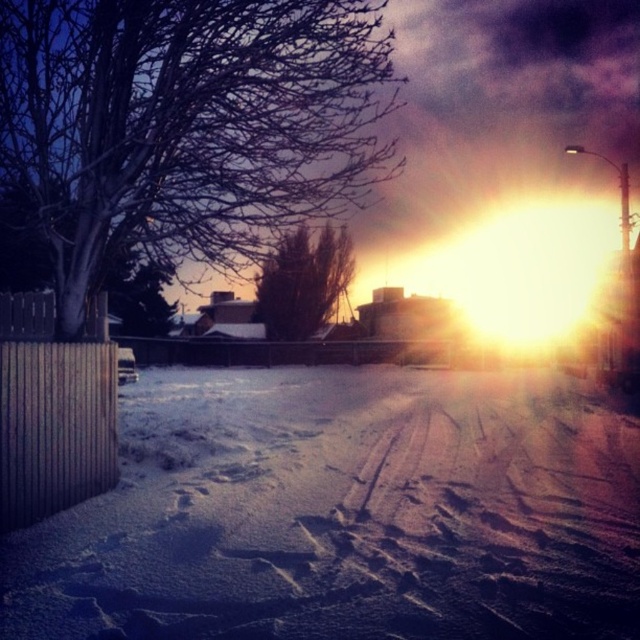
Is point (225, 490) more distant than point (262, 260)?

No.

Can you confirm if white powdery snow at center is positioned below brown textured bush at center?

Yes, white powdery snow at center is below brown textured bush at center.

Where is `white powdery snow at center`? The height and width of the screenshot is (640, 640). white powdery snow at center is located at coordinates (346, 513).

Is white powdery snow at center bigger than bare wood tree at upper left?

Incorrect, white powdery snow at center is not larger than bare wood tree at upper left.

Is point (180, 528) behind point (236, 132)?

That is False.

Is point (577, 486) positioned behind point (33, 102)?

No, (577, 486) is closer to viewer.

You are a GUI agent. You are given a task and a screenshot of the screen. Output one action in this format:
    pyautogui.click(x=<x>, y=<y>)
    Task: Click on the white powdery snow at center
    This screenshot has height=640, width=640.
    Given the screenshot: What is the action you would take?
    pyautogui.click(x=346, y=513)

Does bare wood tree at upper left appear over brown textured bush at center?

Correct, bare wood tree at upper left is located above brown textured bush at center.

Identify the location of bare wood tree at upper left. This screenshot has height=640, width=640. (188, 124).

Between point (19, 60) and point (268, 324), which one is positioned in front?

Point (19, 60) is in front.

Where is `bare wood tree at upper left`? The image size is (640, 640). bare wood tree at upper left is located at coordinates (188, 124).